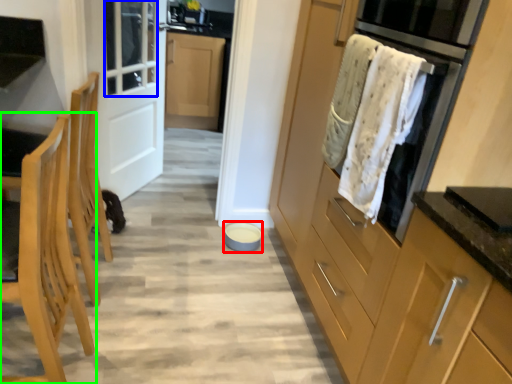
Question: Which is farther away from appliance (highlighted by a red box)? window (highlighted by a blue box) or chair (highlighted by a green box)?

Choices:
 (A) window
 (B) chair

Answer: (B)